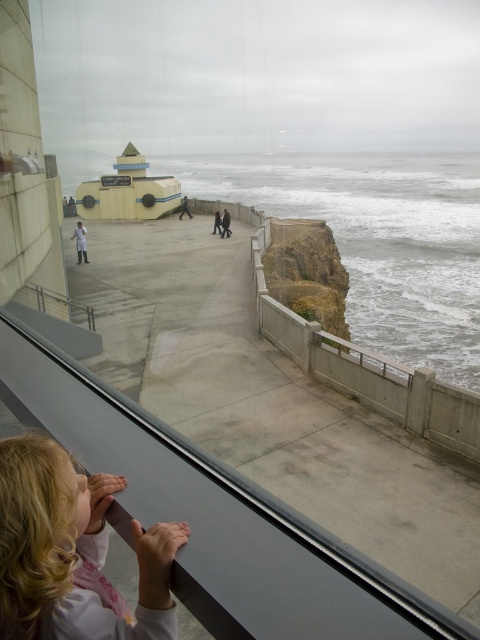
Question: Considering the relative positions of white matte shirt at center and dark blue jeans at center in the image provided, where is white matte shirt at center located with respect to dark blue jeans at center?

Choices:
 (A) right
 (B) left

Answer: (B)

Question: Considering the real-world distances, which object is closest to the dark gray concrete figure at center?

Choices:
 (A) blonde hair at lower left
 (B) brown rocky cliff at center
 (C) dark blue jeans at center
 (D) white matte shirt at center

Answer: (C)

Question: Which point is closer to the camera?

Choices:
 (A) (227, 227)
 (B) (45, 525)

Answer: (B)

Question: Is blonde hair at lower left closer to camera compared to brown rocky cliff at center?

Choices:
 (A) no
 (B) yes

Answer: (B)

Question: Is brown rocky cliff at center thinner than white matte shirt at center?

Choices:
 (A) yes
 (B) no

Answer: (B)

Question: Which of the following is the closest to the observer?

Choices:
 (A) blonde hair at lower left
 (B) white matte shirt at center
 (C) dark gray jacket at center
 (D) brown rocky cliff at center

Answer: (A)